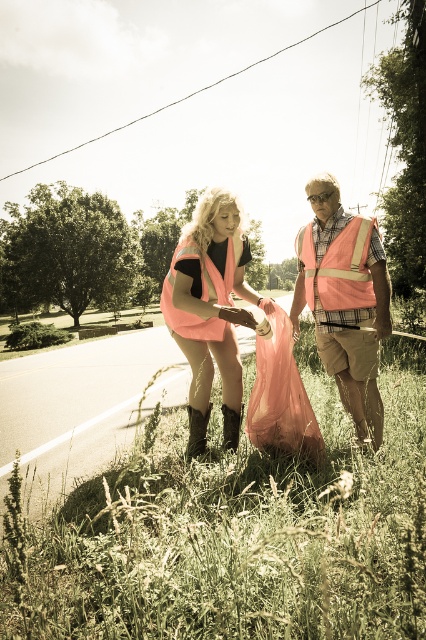
You are a pedestrian trying to decide which vest to wear for visibility. The neon orange vest at center and the pink fabric safety vest at center are available. Which vest would be more visible to drivers?

The neon orange vest at center is more visible because it has a brighter color compared to the pink fabric safety vest at center.

You are a pedestrian walking along the roadside and see both the neon orange vest at center and the reflective orange vest at center. Which vest would appear larger to you?

The neon orange vest at center would appear larger because it is closer to you than the reflective orange vest at center.

In the scene shown: Both people are wearing orange vests. The person on the left is wearing a neon orange vest at center, and the person on the right is wearing a reflective orange vest at center. Which vest is smaller in size?

The neon orange vest at center is smaller in size compared to the reflective orange vest at center.